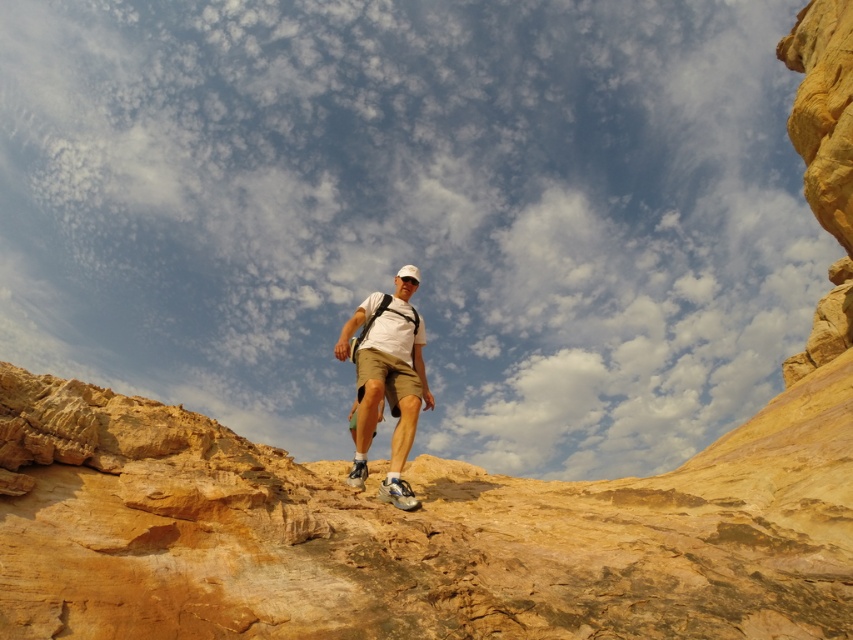
Question: Does white matte t-shirt at center appear under light beige cotton shorts at center?

Choices:
 (A) no
 (B) yes

Answer: (B)

Question: Which object is closer to the camera taking this photo?

Choices:
 (A) light beige cotton shorts at center
 (B) white matte t-shirt at center

Answer: (B)

Question: Which point appears closest to the camera in this image?

Choices:
 (A) click(x=387, y=396)
 (B) click(x=401, y=387)

Answer: (B)

Question: Which of the following is the farthest from the observer?

Choices:
 (A) light beige cotton shorts at center
 (B) white matte t-shirt at center

Answer: (A)

Question: Is white matte t-shirt at center bigger than light beige cotton shorts at center?

Choices:
 (A) no
 (B) yes

Answer: (B)

Question: Can you confirm if white matte t-shirt at center is positioned to the left of light beige cotton shorts at center?

Choices:
 (A) yes
 (B) no

Answer: (B)